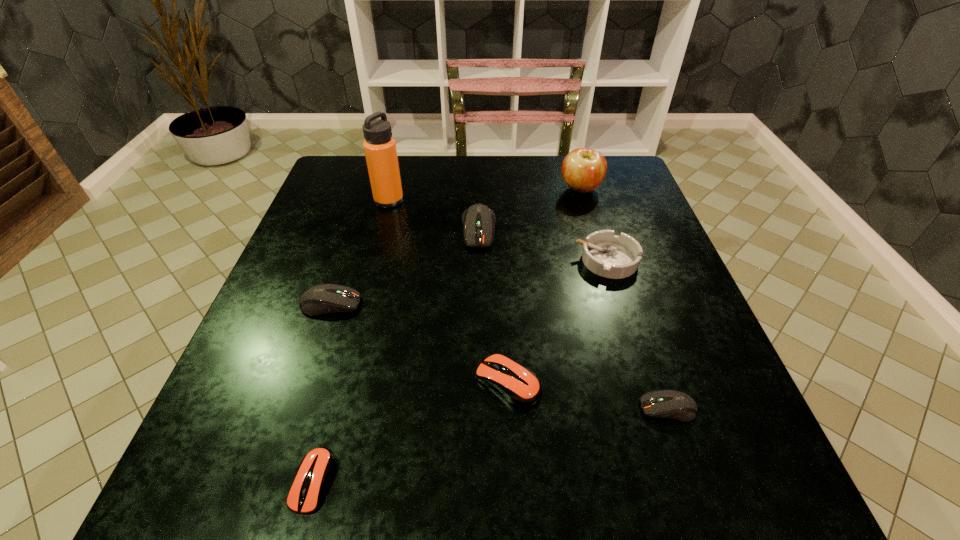
Find the location of a particular element. vacant space that satisfies the following two spatial constraints: 1. on the button of the fourth nearest object; 2. on the back side of the right orange computer mouse is located at coordinates (304, 382).